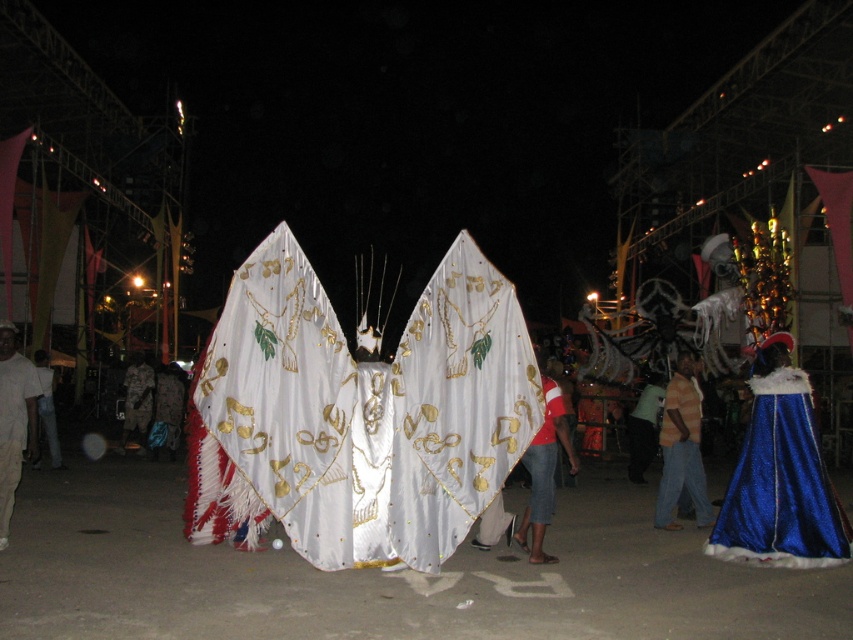
You are a photographer trying to capture the butterfly costume in the foreground. You notice two points marked in the image. Which point, point (355, 451) or point (0, 545), is closer to your camera lens?

Point (355, 451) is closer to the camera than point (0, 545).

You are a photographer at the carnival trying to capture the white satin wings at center and the white cotton shirt at left. Which object should you focus on first if you want to take a photo where both are in focus?

You should focus on the white satin wings at center first since it is closer to the viewer, ensuring both objects will be in focus when using a proper aperture setting.